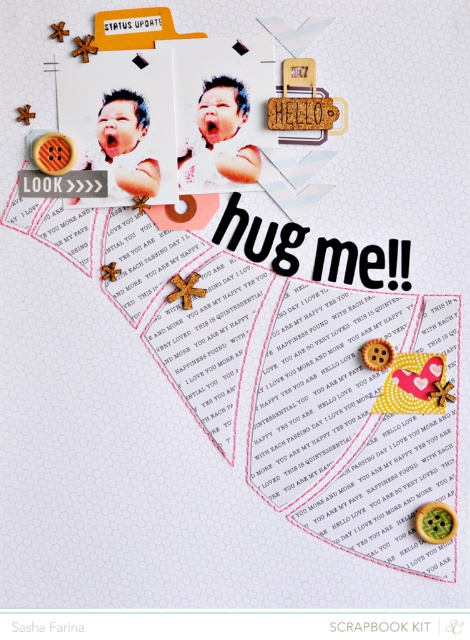
You are designing a scrapbook page and want to place a new sticker between the matte white baby at center and the matte white baby at upper left. Based on their positions, where should you place the sticker?

The matte white baby at center is above the matte white baby at upper left, so you should place the sticker between them by positioning it below the matte white baby at center and above the matte white baby at upper left.

You are designing a scrapbook layout and need to ensure that the two matte white baby photos are spaced appropriately. Given that the minimum required spacing between photos is 2.5 inches, will the current placement of the matte white baby at center and the matte white baby at upper left meet this requirement?

The matte white baby at center and the matte white baby at upper left are 2.66 inches apart, which exceeds the minimum required spacing of 2.5 inches. Therefore, the current placement meets the requirement.